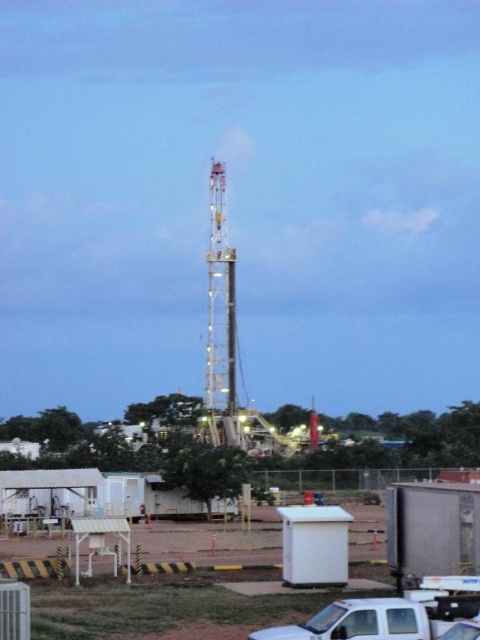
From the picture: Does metallic silver trailer truck at lower right have a greater height compared to white matte truck at lower center?

Yes, metallic silver trailer truck at lower right is taller than white matte truck at lower center.

The height and width of the screenshot is (640, 480). Describe the element at coordinates (432, 531) in the screenshot. I see `metallic silver trailer truck at lower right` at that location.

Identify the location of metallic silver trailer truck at lower right. This screenshot has height=640, width=480. (432, 531).

What are the coordinates of `white plastic container at lower center` in the screenshot? It's located at (229, 609).

Is white plastic container at lower center shorter than white matte truck at lower center?

No, white plastic container at lower center is not shorter than white matte truck at lower center.

Consider the image. Who is more forward, (228, 566) or (342, 634)?

Positioned in front is point (342, 634).

Find the location of `white plastic container at lower center`. white plastic container at lower center is located at coordinates (229, 609).

Which is more to the left, white plastic container at lower center or metallic silver trailer truck at lower right?

white plastic container at lower center

Is white plastic container at lower center bigger than metallic silver trailer truck at lower right?

Yes.

The height and width of the screenshot is (640, 480). I want to click on white plastic container at lower center, so click(229, 609).